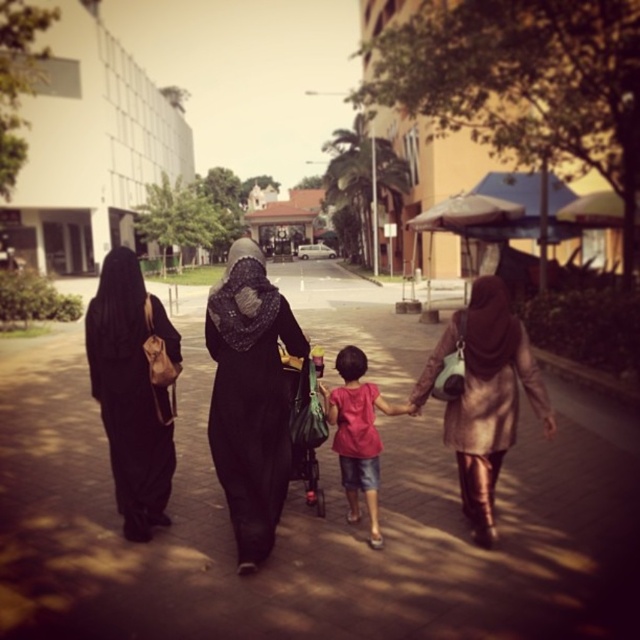
Question: Can you confirm if brown leather coat at center is smaller than pink fabric shirt at center?

Choices:
 (A) no
 (B) yes

Answer: (A)

Question: Observing the image, what is the correct spatial positioning of black matte hijab at center in reference to black matte hijab at left?

Choices:
 (A) above
 (B) below

Answer: (B)

Question: Which point is closer to the camera?

Choices:
 (A) brown paved sidewalk at center
 (B) brown leather coat at center
 (C) black matte hijab at left
 (D) black matte hijab at center

Answer: (A)

Question: Which object is farther from the camera taking this photo?

Choices:
 (A) black matte hijab at center
 (B) pink fabric shirt at center

Answer: (B)

Question: Does black matte hijab at center have a smaller size compared to black matte hijab at left?

Choices:
 (A) no
 (B) yes

Answer: (B)

Question: Which of these objects is positioned closest to the pink fabric shirt at center?

Choices:
 (A) brown paved sidewalk at center
 (B) black matte hijab at left
 (C) brown leather coat at center
 (D) black matte hijab at center

Answer: (D)